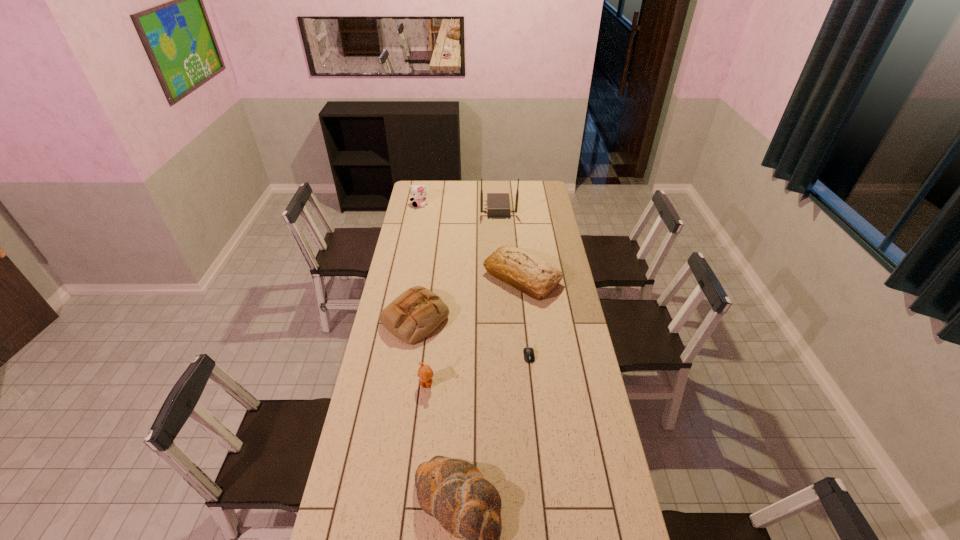
Identify which bread is the nearest to the tallest object. Please provide its 2D coordinates. Your answer should be formatted as a tuple, i.e. [(x, y)], where the tuple contains the x and y coordinates of a point satisfying the conditions above.

[(522, 270)]

I want to click on bread that is the second closest to the teddy bear, so click(467, 506).

Locate an element on the screen. This screenshot has width=960, height=540. free space that satisfies the following two spatial constraints: 1. on the back of the fifth farthest object to connect cables; 2. on the right side of the tallest object is located at coordinates (507, 356).

You are a GUI agent. You are given a task and a screenshot of the screen. Output one action in this format:
    pyautogui.click(x=<x>, y=<y>)
    Task: Click on the vacant region that satisfies the following two spatial constraints: 1. on the front-facing side of the kitten; 2. on the right side of the third nearest object
    
    Given the screenshot: What is the action you would take?
    pyautogui.click(x=390, y=356)

Find the location of `free space that satisfies the following two spatial constraints: 1. on the front-facing side of the shortest object; 2. on the left side of the kitten`. free space that satisfies the following two spatial constraints: 1. on the front-facing side of the shortest object; 2. on the left side of the kitten is located at coordinates (390, 356).